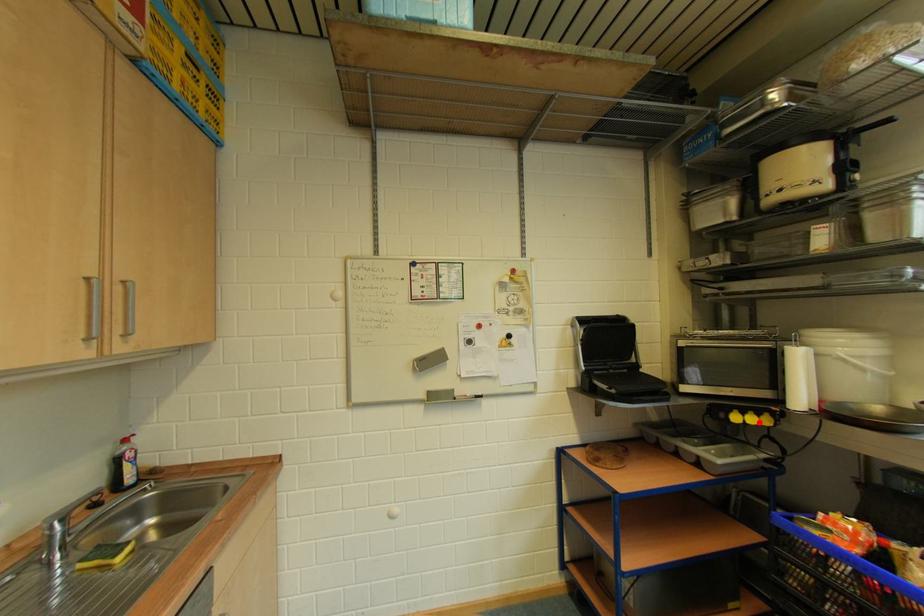
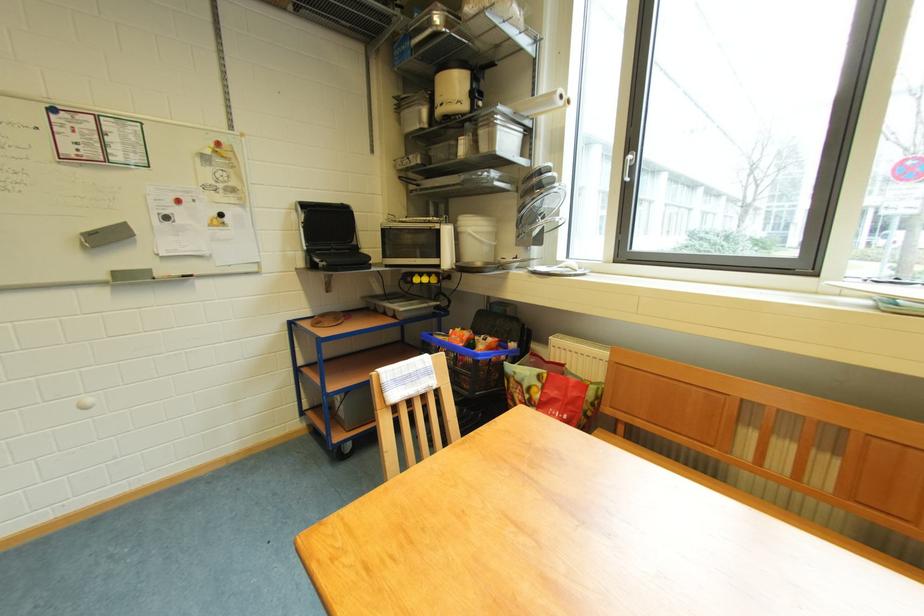
Question: I am providing you with two images of the same scene from different viewpoints. A red point is marked on the first image. At the location where the point appears in image 1, is it still visible in image 2?

Choices:
 (A) Yes
 (B) No

Answer: (A)